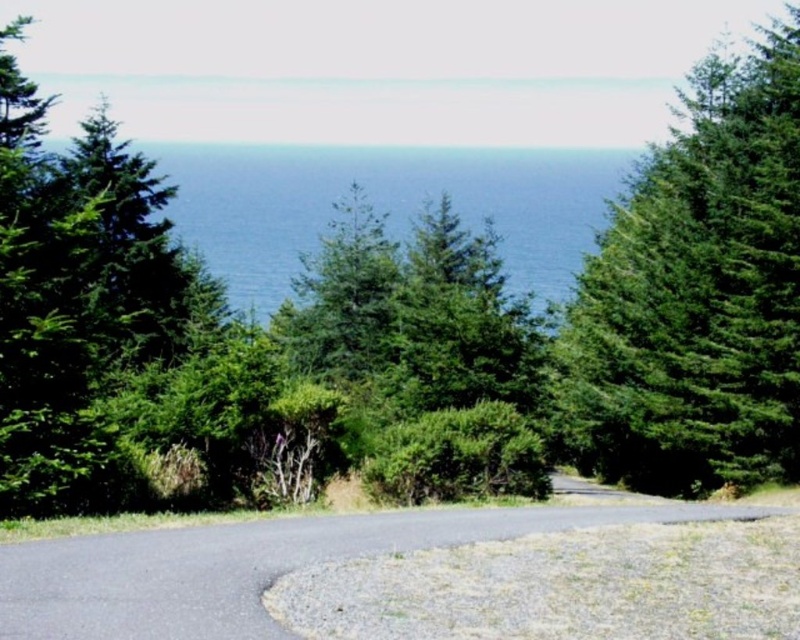
Question: Does green textured tree at upper right have a larger size compared to blue water at center?

Choices:
 (A) no
 (B) yes

Answer: (B)

Question: Does green textured tree at upper right have a greater width compared to blue water at center?

Choices:
 (A) yes
 (B) no

Answer: (B)

Question: From the image, what is the correct spatial relationship of green textured tree at upper right in relation to blue water at center?

Choices:
 (A) below
 (B) above

Answer: (B)

Question: Which of the following is the closest to the observer?

Choices:
 (A) (768, 180)
 (B) (288, 216)

Answer: (A)

Question: Which point is farther to the camera?

Choices:
 (A) blue water at center
 (B) green textured tree at upper right

Answer: (A)

Question: Which of the following is the farthest from the observer?

Choices:
 (A) green textured tree at upper right
 (B) blue water at center

Answer: (B)